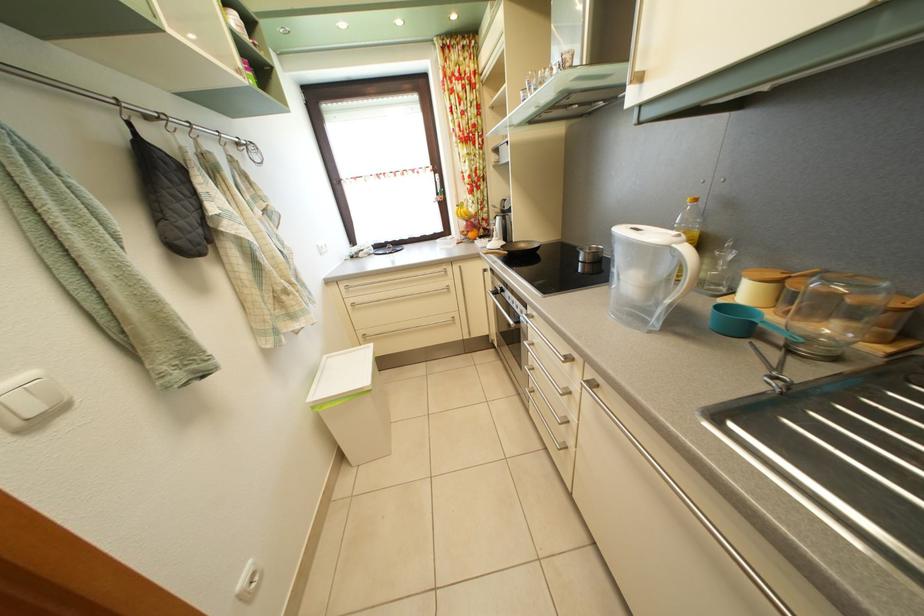
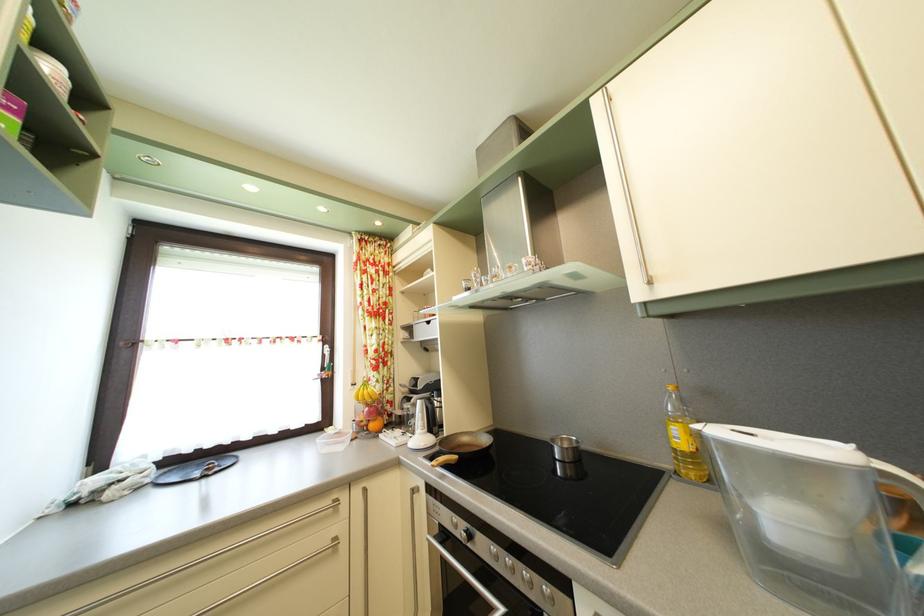
Find the pixel in the second image that matches pixel 737 212 in the first image.

(715, 400)